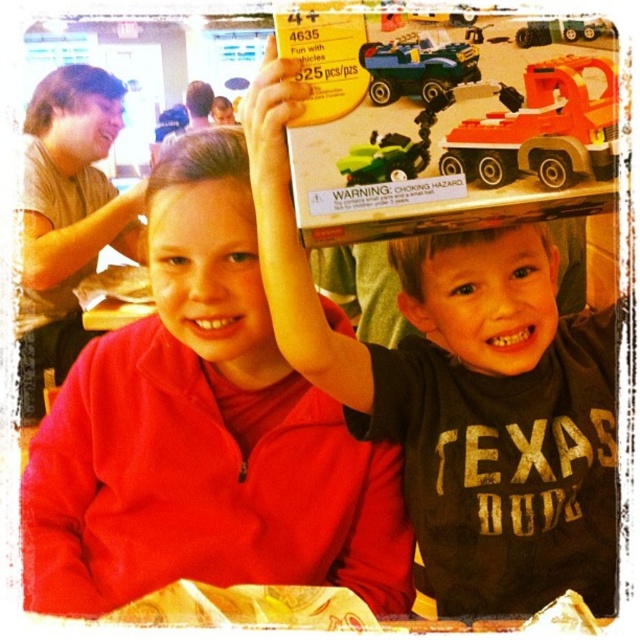
Between point (472, 88) and point (83, 72), which one is positioned behind?

Positioned behind is point (83, 72).

Can you confirm if translucent orange plastic truck at upper center is positioned to the left of matte brown hair at upper left?

In fact, translucent orange plastic truck at upper center is to the right of matte brown hair at upper left.

Where is `translucent orange plastic truck at upper center`? translucent orange plastic truck at upper center is located at coordinates tap(541, 129).

In order to click on translucent orange plastic truck at upper center in this screenshot , I will do `click(541, 129)`.

Which is above, black matte toy box at upper center or matte brown hair at upper left?

matte brown hair at upper left is higher up.

Can you confirm if black matte toy box at upper center is positioned above matte brown hair at upper left?

No, black matte toy box at upper center is not above matte brown hair at upper left.

Describe the element at coordinates (461, 388) in the screenshot. I see `black matte toy box at upper center` at that location.

This screenshot has width=640, height=640. In order to click on black matte toy box at upper center in this screenshot , I will do `click(461, 388)`.

Is matte red jacket at center thinner than green matte toy car at upper center?

In fact, matte red jacket at center might be wider than green matte toy car at upper center.

Is point (410, 577) positioned before point (554, 32)?

No, (410, 577) is behind (554, 32).

Is point (186, 412) behind point (608, 33)?

Yes, point (186, 412) is farther from viewer.

You are a GUI agent. You are given a task and a screenshot of the screen. Output one action in this format:
    pyautogui.click(x=<x>, y=<y>)
    Task: Click on the matte red jacket at center
    
    Given the screenshot: What is the action you would take?
    pyautogui.click(x=204, y=433)